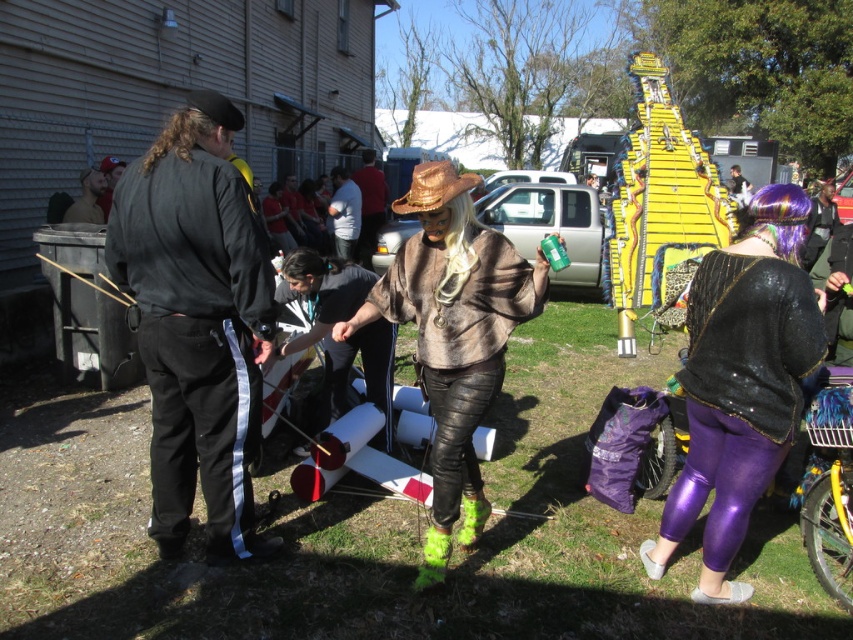
Is metallic purple leggings at lower right above brushed metal can at center?

No.

Between point (718, 273) and point (270, 218), which one is positioned behind?

The point (270, 218) is more distant.

Is point (712, 296) positioned after point (273, 221)?

No, it is in front of (273, 221).

Identify the location of metallic purple leggings at lower right. The height and width of the screenshot is (640, 853). (740, 392).

Is point (709, 554) farther from viewer compared to point (460, 452)?

That is False.

Does metallic purple leggings at lower right lie behind leather pants at center?

That is False.

This screenshot has height=640, width=853. Find the location of `metallic purple leggings at lower right`. metallic purple leggings at lower right is located at coordinates (740, 392).

Is red shirt at center in front of brushed metal can at center?

No, it is not.

Between red shirt at center and brushed metal can at center, which one appears on the left side from the viewer's perspective?

From the viewer's perspective, brushed metal can at center appears more on the left side.

Which is in front, point (366, 182) or point (276, 202)?

Point (276, 202)

The width and height of the screenshot is (853, 640). I want to click on red shirt at center, so click(x=369, y=204).